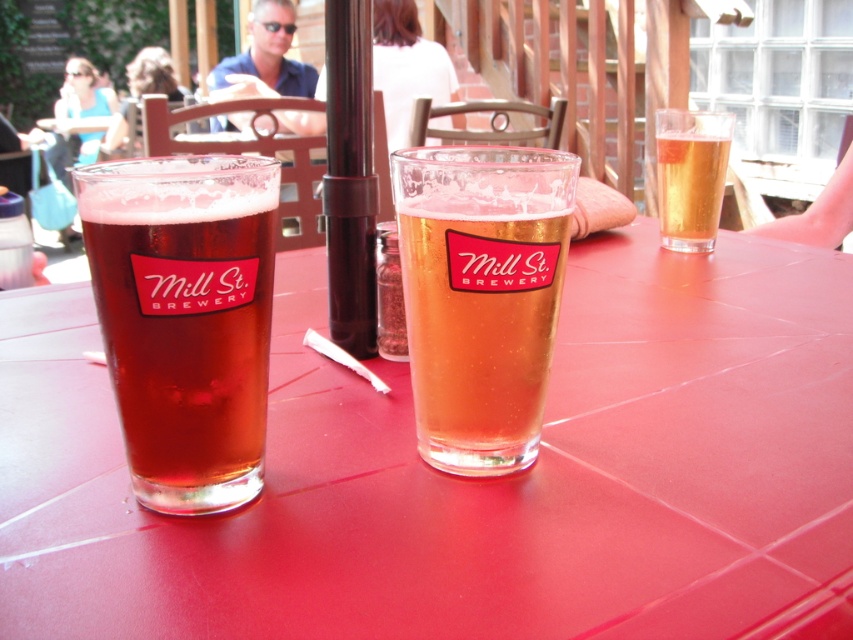
You are standing in the brewery and want to place a 6 inch wide book on the translucent glass table at center. Can the book fit on the table?

The translucent glass table at center is 7.53 inches away from the viewer, but the question is about the table width. Since the description only provides distance, not size, we cannot determine if the book will fit based on the given information.

You are holding a camera and want to take a photo of the point at coordinates point (x=184, y=451). If the camera can only focus on objects within 10 inches, will it be able to capture the point clearly?

The point (x=184, y=451) is 9.76 inches away from the camera, which is within the 10 inches focus range. Therefore, the camera can capture the point clearly.

You are standing at the entrance of the brewery and see two points marked in the scene. Which point is closer to you? The points are point (122, 227) and point (520, 157).

Point (122, 227) is in front of point (520, 157), so it is closer to you.